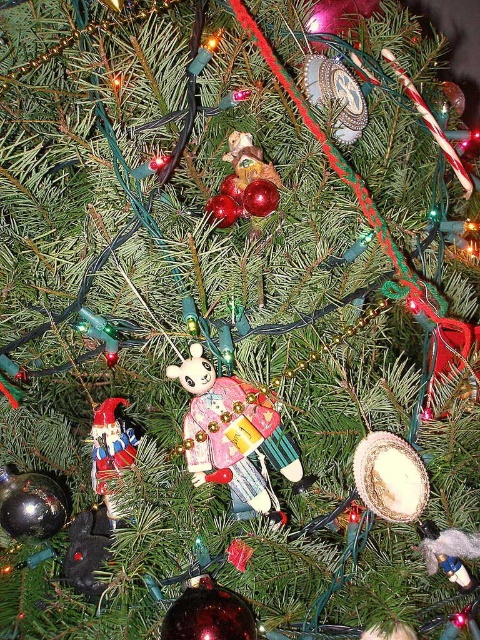
You are a child trying to reach the wooden nutcracker at center and the shiny metallic nutcracker at lower left on the Christmas tree. Your hand can extend 12 centimeters. Can you reach both nutcrackers with one hand?

The distance between the wooden nutcracker at center and the shiny metallic nutcracker at lower left is 13.21 centimeters. Since your hand can only extend 12 centimeters, you cannot reach both with one hand.

You are standing in front of the Christmas tree and want to take a closer look at the wooden nutcracker at center. If your hand can reach up to 2 feet, can you touch it without moving your position?

The wooden nutcracker at center is 27.88 inches away from the camera. Since 2 feet equals 24 inches, the distance is greater than your reach. Therefore, you cannot touch it without moving closer.

What is the object located at the coordinates point (232, 433) on the Christmas tree?

The point (232, 433) corresponds to the wooden nutcracker at center.